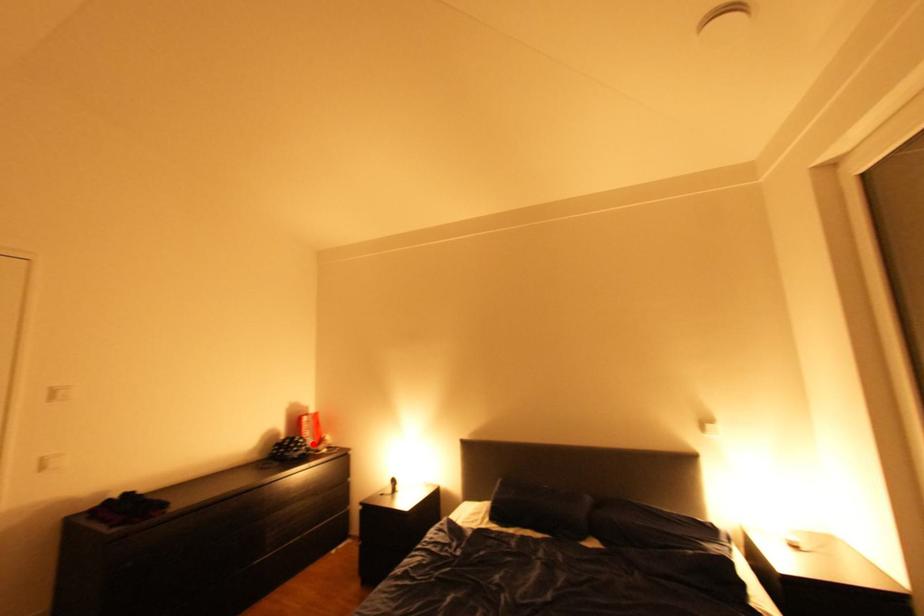
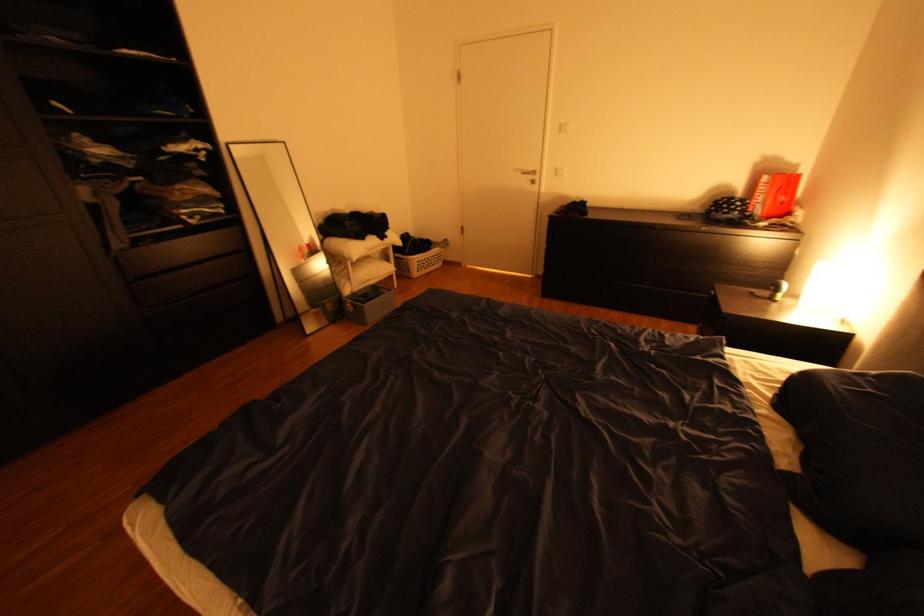
Locate, in the second image, the point that corresponds to the highlighted location in the first image.

(748, 208)